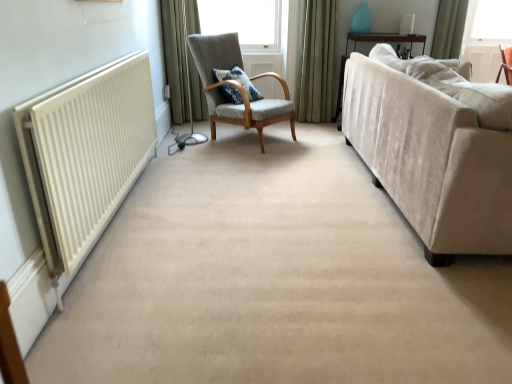
Based on the photo, how much space does green fabric curtain at upper left, which is counted as the third curtain, starting from the right, occupy vertically?

It is 3.76 feet.

Measure the distance between white matte radiator at left and camera.

The distance of white matte radiator at left from camera is 1.47 meters.

The image size is (512, 384). Identify the location of white matte radiator at left. (85, 153).

Measure the distance between green velvet curtain at upper center, placed as the second curtain when sorted from right to left, and camera.

green velvet curtain at upper center, placed as the second curtain when sorted from right to left, and camera are 3.87 meters apart from each other.

Where is `blue patterned cushion at center`? This screenshot has height=384, width=512. blue patterned cushion at center is located at coordinates (238, 81).

Identify the location of green fabric curtain at upper left, which is counted as the third curtain, starting from the right. (175, 59).

Which object is positioned more to the left, green fabric curtain at upper left, the 1th curtain in the left-to-right sequence, or white matte radiator at left?

Positioned to the left is white matte radiator at left.

Is green fabric curtain at upper left, which is counted as the third curtain, starting from the right, located outside white matte radiator at left?

Yes, green fabric curtain at upper left, which is counted as the third curtain, starting from the right, is outside of white matte radiator at left.

Does green fabric curtain at upper left, which is counted as the third curtain, starting from the right, have a greater height compared to white matte radiator at left?

Indeed, green fabric curtain at upper left, which is counted as the third curtain, starting from the right, has a greater height compared to white matte radiator at left.

Is green fabric curtain at upper left, the 1th curtain in the left-to-right sequence, touching white matte radiator at left?

No, green fabric curtain at upper left, the 1th curtain in the left-to-right sequence, is not with white matte radiator at left.

Is green velvet curtain at upper center, placed as the second curtain when sorted from right to left, far from green fabric curtain at upper right, which is counted as the 3th curtain, starting from the left?

Indeed, green velvet curtain at upper center, placed as the second curtain when sorted from right to left, is not near green fabric curtain at upper right, which is counted as the 3th curtain, starting from the left.

Can you confirm if green velvet curtain at upper center, placed as the second curtain when sorted from right to left, is shorter than green fabric curtain at upper right, marked as the 1th curtain in a right-to-left arrangement?

No.

From the image's perspective, who appears lower, green velvet curtain at upper center, marked as the second curtain in a left-to-right arrangement, or green fabric curtain at upper right, which is counted as the 3th curtain, starting from the left?

From the image's view, green velvet curtain at upper center, marked as the second curtain in a left-to-right arrangement, is below.

Locate an element on the screen. This screenshot has width=512, height=384. curtain on the right of green velvet curtain at upper center, marked as the second curtain in a left-to-right arrangement is located at coordinates (449, 29).

Is white matte radiator at left directly adjacent to beige velvet couch at right?

No, white matte radiator at left is not next to beige velvet couch at right.

From a real-world perspective, is white matte radiator at left positioned above or below beige velvet couch at right?

From a real-world perspective, white matte radiator at left is physically below beige velvet couch at right.

How many degrees apart are the facing directions of white matte radiator at left and beige velvet couch at right?

They differ by 0.335 degrees in their facing directions.

Does white matte radiator at left have a lesser height compared to beige velvet couch at right?

Correct, white matte radiator at left is not as tall as beige velvet couch at right.

Which point is more forward, (x=257, y=115) or (x=219, y=73)?

The point (x=257, y=115) is closer.

Is textured gray armchair at center directly adjacent to blue patterned cushion at center?

There is a gap between textured gray armchair at center and blue patterned cushion at center.

How many degrees apart are the facing directions of textured gray armchair at center and blue patterned cushion at center?

The angle between the facing direction of textured gray armchair at center and the facing direction of blue patterned cushion at center is 2.81 degrees.

Who is bigger, textured gray armchair at center or blue patterned cushion at center?

Bigger between the two is textured gray armchair at center.

Find the location of a particular element. The image size is (512, 384). studio couch below the blue patterned cushion at center (from the image's perspective) is located at coordinates (435, 149).

Is beige velvet couch at right placed right next to blue patterned cushion at center?

beige velvet couch at right is not next to blue patterned cushion at center, and they're not touching.

Does beige velvet couch at right lie behind blue patterned cushion at center?

No, beige velvet couch at right is closer to the viewer.

In the scene shown: From the image's perspective, between beige velvet couch at right and blue patterned cushion at center, who is located below?

beige velvet couch at right is shown below in the image.

Is point (461, 18) farther from camera compared to point (241, 72)?

Yes, it is.

Is green fabric curtain at upper right, which is counted as the 3th curtain, starting from the left, situated inside blue patterned cushion at center or outside?

green fabric curtain at upper right, which is counted as the 3th curtain, starting from the left, is spatially situated outside blue patterned cushion at center.

From the image's perspective, which is above, green fabric curtain at upper right, marked as the 1th curtain in a right-to-left arrangement, or blue patterned cushion at center?

green fabric curtain at upper right, marked as the 1th curtain in a right-to-left arrangement, appears higher in the image.

Are green fabric curtain at upper right, marked as the 1th curtain in a right-to-left arrangement, and blue patterned cushion at center far apart?

green fabric curtain at upper right, marked as the 1th curtain in a right-to-left arrangement, is far away from blue patterned cushion at center.

From a real-world perspective, is white matte radiator at left physically below green fabric curtain at upper right, marked as the 1th curtain in a right-to-left arrangement?

Yes.

In the image, is white matte radiator at left positioned in front of or behind green fabric curtain at upper right, which is counted as the 3th curtain, starting from the left?

white matte radiator at left is positioned closer to the viewer than green fabric curtain at upper right, which is counted as the 3th curtain, starting from the left.

Considering the points (35, 161) and (461, 0), which point is behind, point (35, 161) or point (461, 0)?

The point (461, 0) is more distant.

Locate an element on the screen. This screenshot has height=384, width=512. the 1st curtain behind when counting from the white matte radiator at left is located at coordinates (175, 59).

Identify the location of the 1st curtain counting from the left of the green fabric curtain at upper right, which is counted as the 3th curtain, starting from the left. (315, 60).

When comparing their distances from textured gray armchair at center, does white matte radiator at left or green fabric curtain at upper left, which is counted as the third curtain, starting from the right, seem closer?

green fabric curtain at upper left, which is counted as the third curtain, starting from the right, is closer to textured gray armchair at center.

From the image, which object appears to be farther from white matte radiator at left, green velvet curtain at upper center, marked as the second curtain in a left-to-right arrangement, or beige velvet couch at right?

green velvet curtain at upper center, marked as the second curtain in a left-to-right arrangement, is positioned further to the anchor white matte radiator at left.

Considering their positions, is blue patterned cushion at center positioned further to beige velvet couch at right than white matte radiator at left?

blue patterned cushion at center.

Which object lies further to the anchor point white matte radiator at left, beige velvet couch at right or blue patterned cushion at center?

blue patterned cushion at center lies further to white matte radiator at left than the other object.

Which object lies further to the anchor point beige velvet couch at right, green velvet curtain at upper center, marked as the second curtain in a left-to-right arrangement, or green fabric curtain at upper left, which is counted as the third curtain, starting from the right?

green fabric curtain at upper left, which is counted as the third curtain, starting from the right.

Based on their spatial positions, is beige velvet couch at right or textured gray armchair at center further from green fabric curtain at upper left, the 1th curtain in the left-to-right sequence?

Among the two, beige velvet couch at right is located further to green fabric curtain at upper left, the 1th curtain in the left-to-right sequence.

Based on their spatial positions, is textured gray armchair at center or blue patterned cushion at center closer to white matte radiator at left?

textured gray armchair at center lies closer to white matte radiator at left than the other object.

Which object lies further to the anchor point white matte radiator at left, green fabric curtain at upper right, which is counted as the 3th curtain, starting from the left, or beige velvet couch at right?

green fabric curtain at upper right, which is counted as the 3th curtain, starting from the left, lies further to white matte radiator at left than the other object.

This screenshot has width=512, height=384. I want to click on chair between white matte radiator at left and green velvet curtain at upper center, placed as the second curtain when sorted from right to left, along the z-axis, so click(x=236, y=87).

This screenshot has width=512, height=384. Identify the location of curtain positioned between white matte radiator at left and green velvet curtain at upper center, placed as the second curtain when sorted from right to left, from near to far. (175, 59).

The image size is (512, 384). I want to click on chair between white matte radiator at left and green fabric curtain at upper left, which is counted as the third curtain, starting from the right, in the front-back direction, so click(236, 87).

I want to click on studio couch positioned between white matte radiator at left and blue patterned cushion at center from near to far, so click(x=435, y=149).